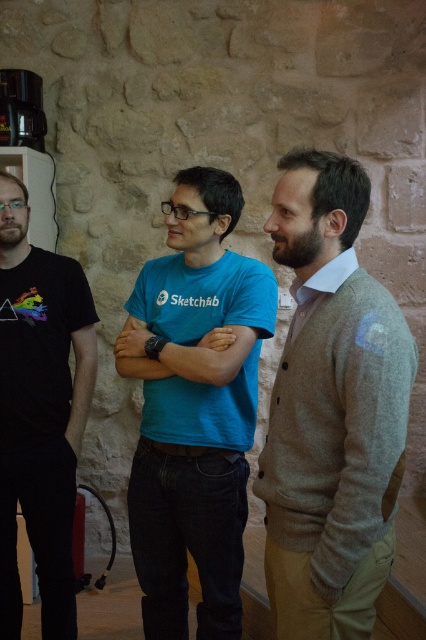
Question: Is light brown cardigan at center smaller than matte blue t-shirt at center?

Choices:
 (A) no
 (B) yes

Answer: (A)

Question: Does black matte t-shirt at left have a lesser width compared to matte blue t-shirt at center?

Choices:
 (A) no
 (B) yes

Answer: (B)

Question: Which is nearer to the matte blue t-shirt at center?

Choices:
 (A) blue cotton shirt at center
 (B) black matte t-shirt at left
 (C) light brown cardigan at center

Answer: (A)

Question: Which point is closer to the camera taking this photo?

Choices:
 (A) pos(54,588)
 (B) pos(189,349)
 (C) pos(368,524)

Answer: (C)

Question: Which is farther from the light brown cardigan at center?

Choices:
 (A) black matte t-shirt at left
 (B) matte blue t-shirt at center
 (C) blue cotton shirt at center

Answer: (A)

Question: Is black matte t-shirt at left below matte blue t-shirt at center?

Choices:
 (A) yes
 (B) no

Answer: (A)